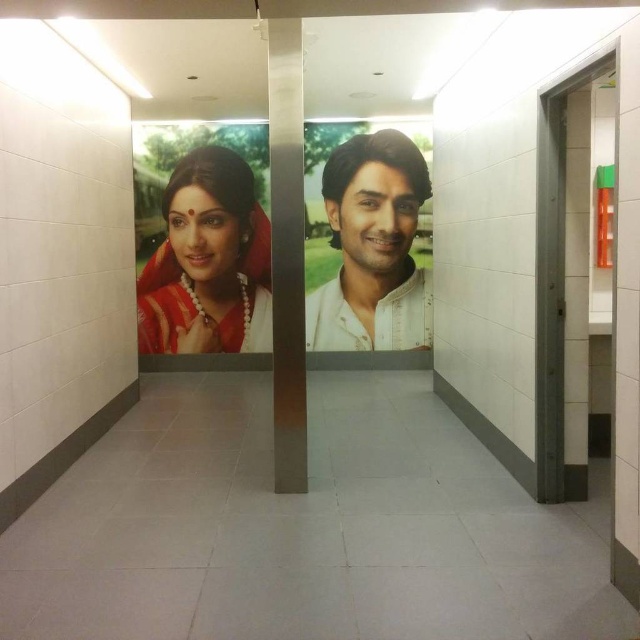
Is matte red saree at center taller than white cotton shirt at center?

No, matte red saree at center is not taller than white cotton shirt at center.

Between matte red saree at center and white cotton shirt at center, which one appears on the left side from the viewer's perspective?

matte red saree at center is more to the left.

Find the location of a particular element. The height and width of the screenshot is (640, 640). matte red saree at center is located at coordinates (208, 260).

You are a GUI agent. You are given a task and a screenshot of the screen. Output one action in this format:
    pyautogui.click(x=<x>, y=<y>)
    Task: Click on the matte red saree at center
    
    Given the screenshot: What is the action you would take?
    point(208,260)